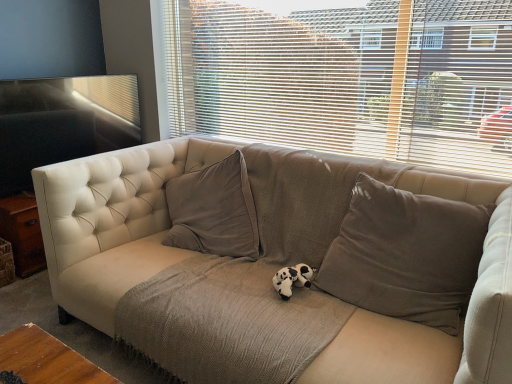
Question: From the image's perspective, does beige fabric blinds at upper center appear lower than beige fabric couch at center?

Choices:
 (A) yes
 (B) no

Answer: (B)

Question: Could you tell me if beige fabric blinds at upper center is facing beige fabric couch at center?

Choices:
 (A) yes
 (B) no

Answer: (B)

Question: Can you confirm if beige fabric blinds at upper center is thinner than beige fabric couch at center?

Choices:
 (A) no
 (B) yes

Answer: (B)

Question: Is beige fabric blinds at upper center taller than beige fabric couch at center?

Choices:
 (A) no
 (B) yes

Answer: (B)

Question: Is the surface of beige fabric blinds at upper center in direct contact with beige fabric couch at center?

Choices:
 (A) no
 (B) yes

Answer: (A)

Question: In terms of size, does beige fabric blinds at upper center appear bigger or smaller than black plush toy at center?

Choices:
 (A) big
 (B) small

Answer: (A)

Question: From the image's perspective, is beige fabric blinds at upper center positioned above or below black plush toy at center?

Choices:
 (A) above
 (B) below

Answer: (A)

Question: Is beige fabric blinds at upper center inside or outside of black plush toy at center?

Choices:
 (A) outside
 (B) inside

Answer: (A)

Question: Is beige fabric blinds at upper center in front of or behind black plush toy at center in the image?

Choices:
 (A) front
 (B) behind

Answer: (B)

Question: Is beige fabric couch at center taller or shorter than beige fabric blinds at upper center?

Choices:
 (A) short
 (B) tall

Answer: (A)

Question: From a real-world perspective, relative to beige fabric blinds at upper center, is beige fabric couch at center vertically above or below?

Choices:
 (A) above
 (B) below

Answer: (B)

Question: Relative to beige fabric blinds at upper center, is beige fabric couch at center in front or behind?

Choices:
 (A) front
 (B) behind

Answer: (A)

Question: Does point (480, 193) appear closer or farther from the camera than point (206, 21)?

Choices:
 (A) farther
 (B) closer

Answer: (B)

Question: In the image, is black plush toy at center positioned in front of or behind beige fabric couch at center?

Choices:
 (A) behind
 (B) front

Answer: (A)

Question: Considering the positions of point (285, 296) and point (410, 322), is point (285, 296) closer or farther from the camera than point (410, 322)?

Choices:
 (A) farther
 (B) closer

Answer: (A)